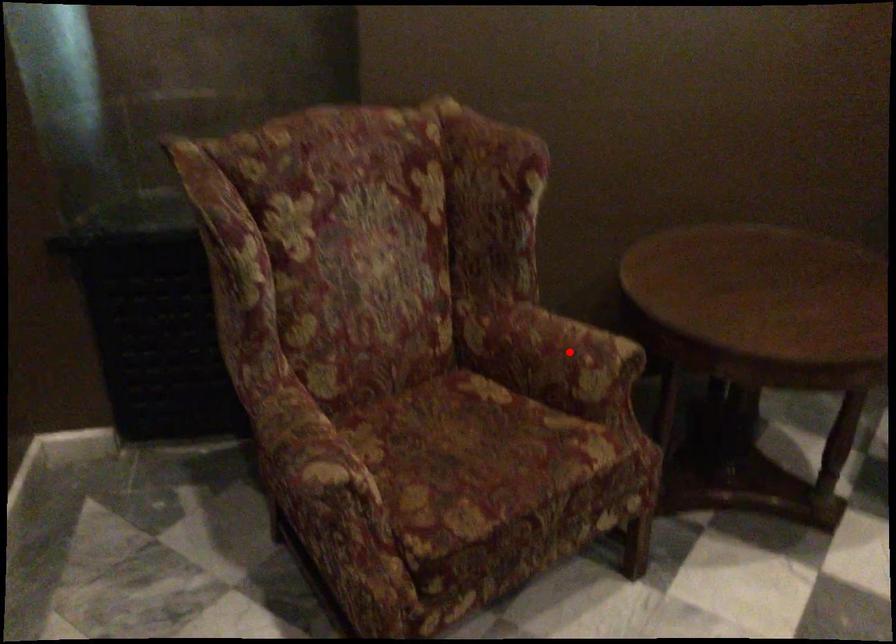
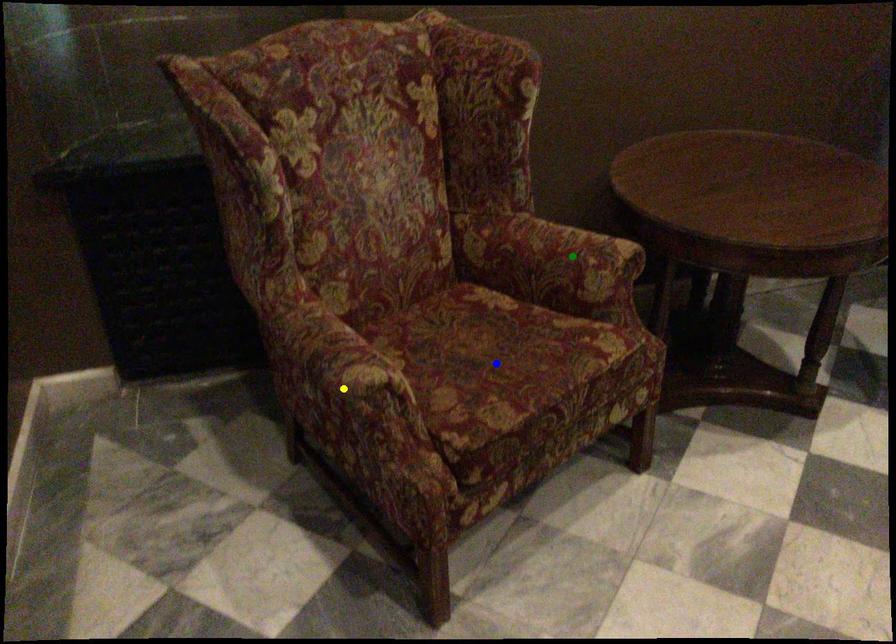
Question: I am providing you with two images of the same scene from different viewpoints. A red point is marked on the first image. You are given multiple points on the second image. Which point in image 2 represents the same 3d spot as the red point in image 1?

Choices:
 (A) blue point
 (B) yellow point
 (C) green point

Answer: (C)